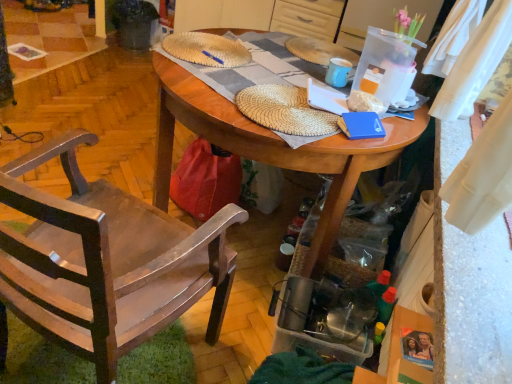
This screenshot has height=384, width=512. What are the coordinates of `vacant space situated on the left part of blue matte book at center` in the screenshot? It's located at (309, 111).